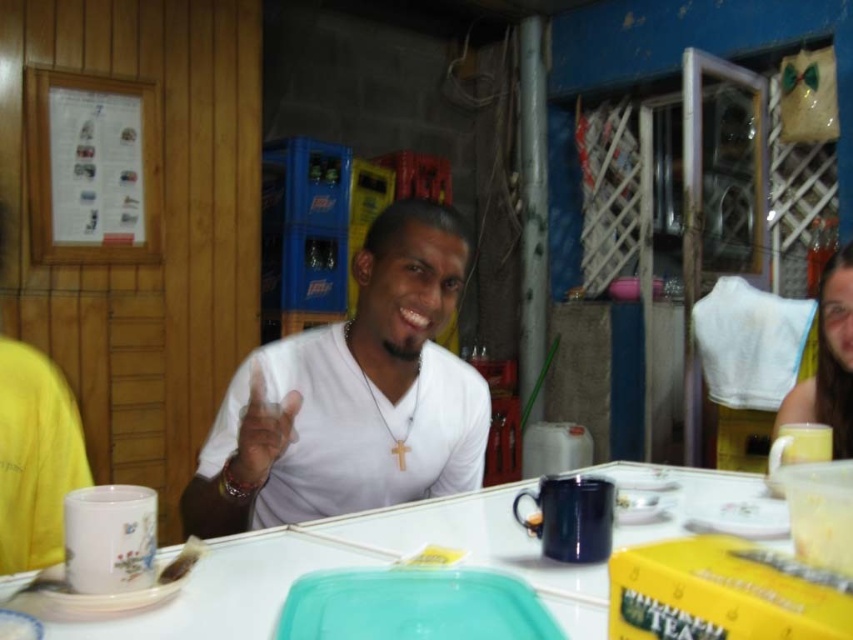
You are a photographer taking a picture of the scene. You want to ensure the white matte shirt at center and the matte yellow mug at right are both clearly visible. Which object should you focus on first to ensure both are in focus?

The white matte shirt at center is in front of the matte yellow mug at right, so you should focus on the white matte shirt at center first to ensure both are in focus.

You are a customer at the cafe and want to place your phone on the white glossy table at center. However, there is already a white matte shirt at center on it. Can you still place your phone there?

The white matte shirt at center is positioned on the left side of white glossy table at center. Since the shirt is on the table, it may occupy space, but there might still be room on other areas of the table to place your phone. Check if there is enough space on the right side or other areas of the white glossy table at center not covered by the shirt.

Looking at this image, you are a barista in a cafe and need to place both the white glossy table at center and the matte yellow mug at right on a shelf. Which object should you place first if you want to ensure they both fit on the shelf?

The white glossy table at center is smaller than the matte yellow mug at right, so you should place the matte yellow mug at right first to ensure there is enough space for both items on the shelf.